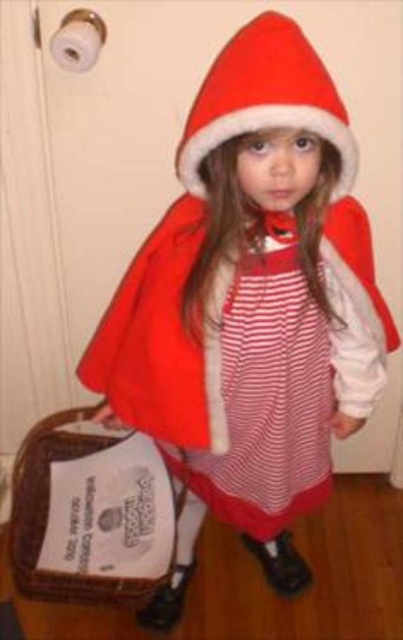
In the scene shown: Is red striped dress at center below red velvet santa hat at center?

Correct, red striped dress at center is located below red velvet santa hat at center.

Who is higher up, red striped dress at center or red velvet santa hat at center?

red velvet santa hat at center

Is point (317, 497) positioned behind point (282, 17)?

Yes, it is behind point (282, 17).

Identify the location of red striped dress at center. The width and height of the screenshot is (403, 640). (265, 401).